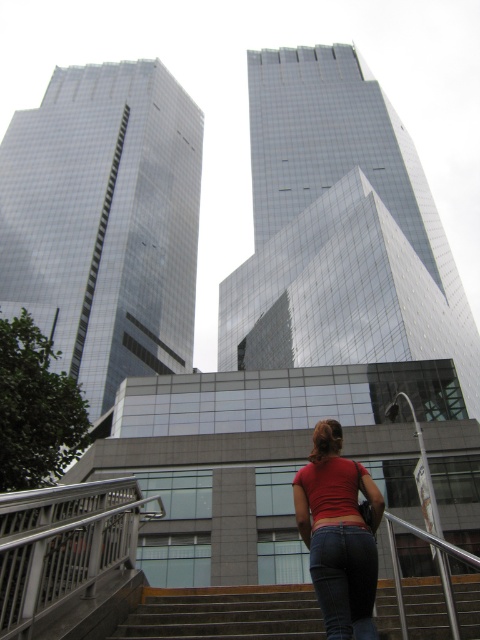
Question: Can you confirm if glassy reflective skyscraper at left is positioned above concrete stairs at lower center?

Choices:
 (A) no
 (B) yes

Answer: (B)

Question: Which point is farther from the camera taking this photo?

Choices:
 (A) (416, 317)
 (B) (324, 524)

Answer: (A)

Question: Which point is closer to the camera?

Choices:
 (A) glassy reflective skyscraper at left
 (B) concrete stairs at lower center

Answer: (B)

Question: Is concrete stairs at lower center smaller than denim at center?

Choices:
 (A) no
 (B) yes

Answer: (B)

Question: Which point is farther to the camera?

Choices:
 (A) (34, 582)
 (B) (320, 464)
 (C) (334, 360)
 (D) (257, 612)

Answer: (C)

Question: Where is glassy reflective skyscraper at left located in relation to red matte shirt at center in the image?

Choices:
 (A) below
 (B) above

Answer: (B)